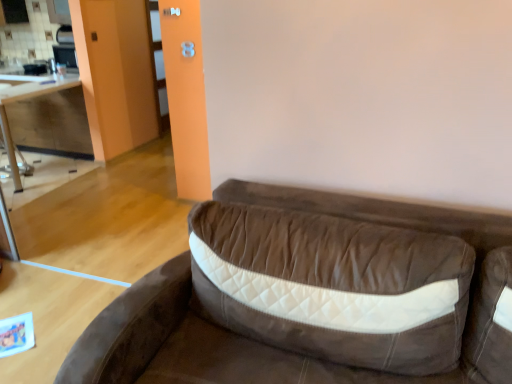
Question: Does wooden table at left turn towards wooden cabinet at left?

Choices:
 (A) yes
 (B) no

Answer: (B)

Question: Is wooden table at left closer to camera compared to wooden cabinet at left?

Choices:
 (A) no
 (B) yes

Answer: (B)

Question: Considering the relative sizes of wooden table at left and wooden cabinet at left in the image provided, is wooden table at left taller than wooden cabinet at left?

Choices:
 (A) yes
 (B) no

Answer: (A)

Question: From a real-world perspective, is wooden table at left positioned over wooden cabinet at left based on gravity?

Choices:
 (A) yes
 (B) no

Answer: (B)

Question: Would you say wooden table at left is a long distance from wooden cabinet at left?

Choices:
 (A) yes
 (B) no

Answer: (B)

Question: Considering the positions of brown suede studio couch at center and wooden table at left in the image, is brown suede studio couch at center bigger or smaller than wooden table at left?

Choices:
 (A) small
 (B) big

Answer: (B)

Question: In terms of height, does brown suede studio couch at center look taller or shorter compared to wooden table at left?

Choices:
 (A) short
 (B) tall

Answer: (B)

Question: Considering the relative positions of brown suede studio couch at center and wooden table at left in the image provided, is brown suede studio couch at center to the left or to the right of wooden table at left?

Choices:
 (A) left
 (B) right

Answer: (B)

Question: Is brown suede studio couch at center spatially inside wooden table at left, or outside of it?

Choices:
 (A) outside
 (B) inside

Answer: (A)

Question: In terms of height, does wooden cabinet at left look taller or shorter compared to brown suede studio couch at center?

Choices:
 (A) short
 (B) tall

Answer: (A)

Question: Is wooden cabinet at left wider or thinner than brown suede studio couch at center?

Choices:
 (A) wide
 (B) thin

Answer: (B)

Question: From a real-world perspective, relative to brown suede studio couch at center, is wooden cabinet at left vertically above or below?

Choices:
 (A) above
 (B) below

Answer: (A)

Question: In terms of size, does wooden cabinet at left appear bigger or smaller than brown suede studio couch at center?

Choices:
 (A) small
 (B) big

Answer: (A)

Question: Considering the positions of brown suede studio couch at center and wooden cabinet at left in the image, is brown suede studio couch at center wider or thinner than wooden cabinet at left?

Choices:
 (A) thin
 (B) wide

Answer: (B)

Question: Is brown suede studio couch at center spatially inside wooden cabinet at left, or outside of it?

Choices:
 (A) inside
 (B) outside

Answer: (B)